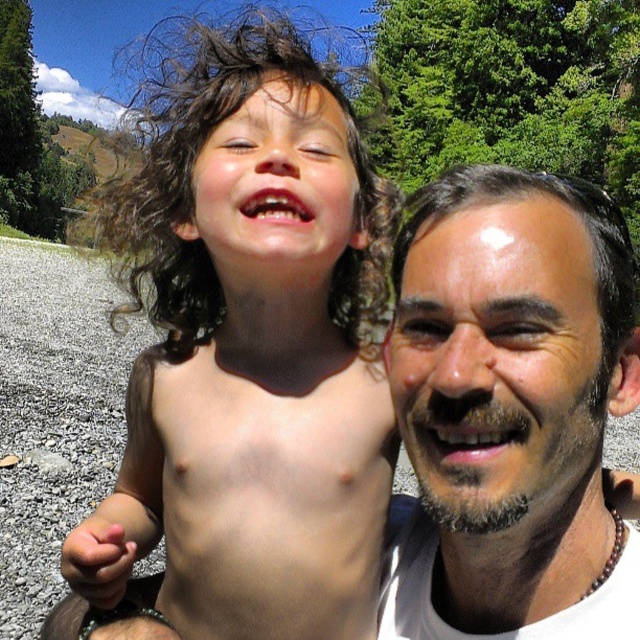
Based on the scene description, where is the smooth skin face at right located in the image?

The smooth skin face at right is located at point coordinates of 0.642 in the x axis and 0.798 in the y axis.

You are standing in front of the image and want to know how far the point at coordinates point (513, 228) is from you. Can you determine the distance?

The distance between point (513, 228) and the viewer is 25.70 inches.